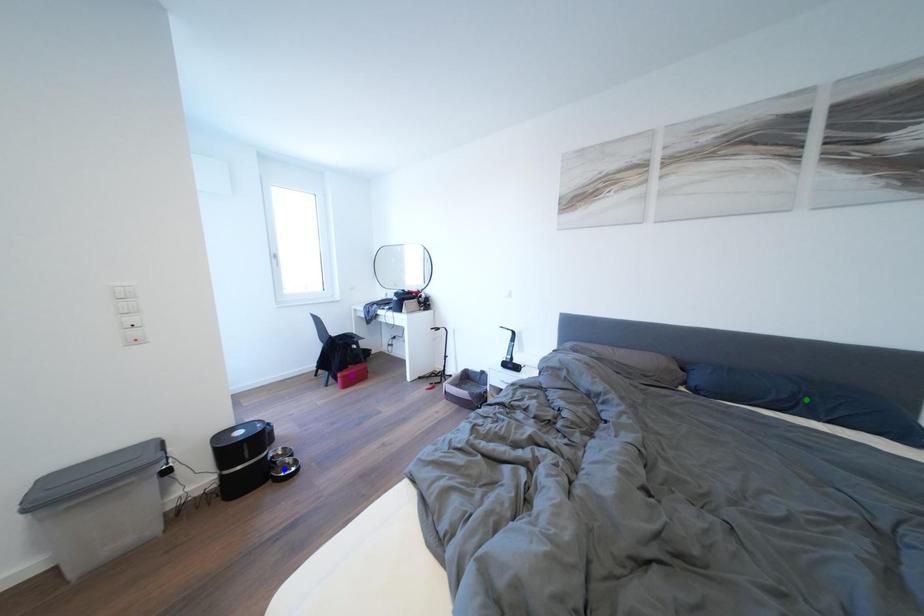
Order these from nearest to farthest:
purple point
blue point
green point

purple point < blue point < green point